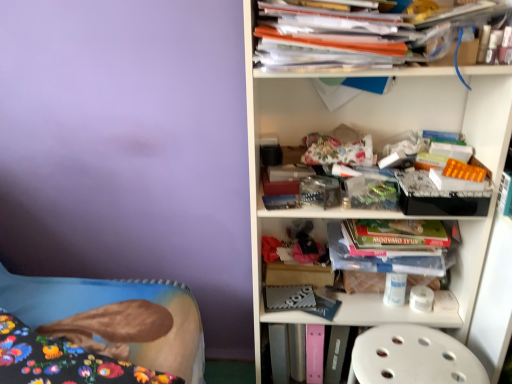
Question: Is the position of purple matte wall at upper left less distant than that of fluffy fabric bed at lower left?

Choices:
 (A) yes
 (B) no

Answer: (A)

Question: Is purple matte wall at upper left smaller than fluffy fabric bed at lower left?

Choices:
 (A) no
 (B) yes

Answer: (A)

Question: Is purple matte wall at upper left located outside fluffy fabric bed at lower left?

Choices:
 (A) yes
 (B) no

Answer: (A)

Question: Does purple matte wall at upper left come behind fluffy fabric bed at lower left?

Choices:
 (A) yes
 (B) no

Answer: (B)

Question: Can you confirm if purple matte wall at upper left is positioned to the right of fluffy fabric bed at lower left?

Choices:
 (A) no
 (B) yes

Answer: (A)

Question: Is purple matte wall at upper left aimed at fluffy fabric bed at lower left?

Choices:
 (A) yes
 (B) no

Answer: (A)

Question: Is translucent plastic container at center, placed as the 1th shelf when sorted from bottom to top, surrounded by purple matte wall at upper left?

Choices:
 (A) no
 (B) yes

Answer: (A)

Question: Considering the relative sizes of purple matte wall at upper left and translucent plastic container at center, placed as the 1th shelf when sorted from bottom to top, in the image provided, is purple matte wall at upper left taller than translucent plastic container at center, placed as the 1th shelf when sorted from bottom to top,?

Choices:
 (A) no
 (B) yes

Answer: (B)

Question: From the image's perspective, is purple matte wall at upper left located beneath translucent plastic container at center, arranged as the 2th shelf when viewed from the top?

Choices:
 (A) yes
 (B) no

Answer: (A)

Question: Does purple matte wall at upper left appear on the right side of translucent plastic container at center, arranged as the 2th shelf when viewed from the top?

Choices:
 (A) no
 (B) yes

Answer: (A)

Question: Considering the relative sizes of purple matte wall at upper left and translucent plastic container at center, arranged as the 2th shelf when viewed from the top, in the image provided, is purple matte wall at upper left thinner than translucent plastic container at center, arranged as the 2th shelf when viewed from the top,?

Choices:
 (A) yes
 (B) no

Answer: (B)

Question: Can you confirm if purple matte wall at upper left is wider than translucent plastic container at center, placed as the 1th shelf when sorted from bottom to top?

Choices:
 (A) no
 (B) yes

Answer: (B)

Question: From a real-world perspective, is fluffy fabric bed at lower left positioned over white plastic shelf at upper right, acting as the 2th shelf starting from the bottom, based on gravity?

Choices:
 (A) no
 (B) yes

Answer: (A)